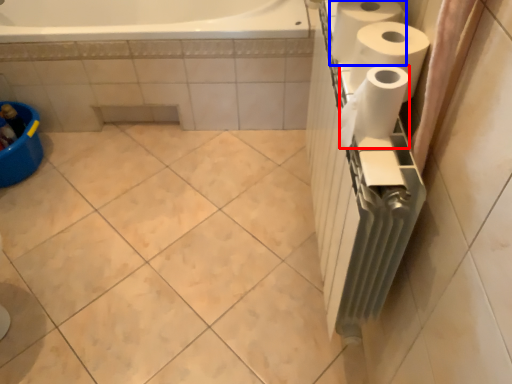
Question: Which object appears closest to the camera in this image, paper towel (highlighted by a red box) or paper towel (highlighted by a blue box)?

Choices:
 (A) paper towel
 (B) paper towel

Answer: (A)